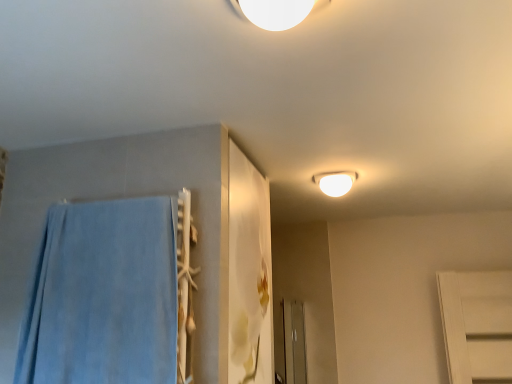
The image size is (512, 384). What are the coordinates of `blue soft towel at left` in the screenshot? It's located at (103, 296).

What is the approximate width of blue soft towel at left?

5.42 inches.

The image size is (512, 384). What do you see at coordinates (103, 296) in the screenshot?
I see `blue soft towel at left` at bounding box center [103, 296].

The width and height of the screenshot is (512, 384). Describe the element at coordinates (335, 182) in the screenshot. I see `white glossy light fixture at upper center` at that location.

Locate an element on the screen. The width and height of the screenshot is (512, 384). white glossy light fixture at upper center is located at coordinates (335, 182).

I want to click on blue soft towel at left, so click(103, 296).

Between blue soft towel at left and white glossy light fixture at upper center, which one appears on the left side from the viewer's perspective?

Positioned to the left is blue soft towel at left.

Looking at this image, relative to white glossy light fixture at upper center, is blue soft towel at left in front or behind?

Visually, blue soft towel at left is located in front of white glossy light fixture at upper center.

Considering the points (66, 291) and (322, 179), which point is behind, point (66, 291) or point (322, 179)?

The point (322, 179) is farther from the camera.

From the image's perspective, is blue soft towel at left located above white glossy light fixture at upper center?

No, from the image's perspective, blue soft towel at left is not on top of white glossy light fixture at upper center.

Looking at this image, from a real-world perspective, relative to white glossy light fixture at upper center, is blue soft towel at left vertically above or below?

blue soft towel at left is below white glossy light fixture at upper center.

Does blue soft towel at left have a greater width compared to white glossy light fixture at upper center?

Incorrect, the width of blue soft towel at left does not surpass that of white glossy light fixture at upper center.

Which of these two, blue soft towel at left or white glossy light fixture at upper center, stands taller?

blue soft towel at left is taller.

Can you confirm if blue soft towel at left is bigger than white glossy light fixture at upper center?

Correct, blue soft towel at left is larger in size than white glossy light fixture at upper center.

Choose the correct answer: Is blue soft towel at left inside white glossy light fixture at upper center or outside it?

blue soft towel at left exists outside the volume of white glossy light fixture at upper center.

Would you say blue soft towel at left is a long distance from white glossy light fixture at upper center?

That's right, there is a large distance between blue soft towel at left and white glossy light fixture at upper center.

Is blue soft towel at left turned away from white glossy light fixture at upper center?

No, blue soft towel at left's orientation is not away from white glossy light fixture at upper center.

What's the angular difference between blue soft towel at left and white glossy light fixture at upper center's facing directions?

blue soft towel at left and white glossy light fixture at upper center are facing 82.6 degrees away from each other.

Where is `bath towel located on the left of white glossy light fixture at upper center`? bath towel located on the left of white glossy light fixture at upper center is located at coordinates (103, 296).

Is white glossy light fixture at upper center to the right of blue soft towel at left from the viewer's perspective?

Yes.

Is white glossy light fixture at upper center behind blue soft towel at left?

Yes, white glossy light fixture at upper center is further from the viewer.

Which point is more forward, (348, 190) or (69, 364)?

Point (69, 364)

From the image's perspective, is white glossy light fixture at upper center above blue soft towel at left?

Yes, from the image's perspective, white glossy light fixture at upper center is above blue soft towel at left.

From a real-world perspective, relative to blue soft towel at left, is white glossy light fixture at upper center vertically above or below?

From a real-world perspective, white glossy light fixture at upper center is physically above blue soft towel at left.

Between white glossy light fixture at upper center and blue soft towel at left, which one has smaller width?

With smaller width is blue soft towel at left.

Who is taller, white glossy light fixture at upper center or blue soft towel at left?

blue soft towel at left.

Does white glossy light fixture at upper center have a larger size compared to blue soft towel at left?

Incorrect, white glossy light fixture at upper center is not larger than blue soft towel at left.

Do you think white glossy light fixture at upper center is within blue soft towel at left, or outside of it?

white glossy light fixture at upper center is not inside blue soft towel at left, it's outside.

Does white glossy light fixture at upper center touch blue soft towel at left?

white glossy light fixture at upper center and blue soft towel at left are not in contact.

Is white glossy light fixture at upper center oriented towards blue soft towel at left?

No, white glossy light fixture at upper center is not aimed at blue soft towel at left.

Can you tell me how much white glossy light fixture at upper center and blue soft towel at left differ in facing direction?

They differ by 82.6 degrees in their facing directions.

Measure the distance from white glossy light fixture at upper center to blue soft towel at left.

A distance of 1.32 meters exists between white glossy light fixture at upper center and blue soft towel at left.

Identify the location of lamp lying on the right of blue soft towel at left. (335, 182).

This screenshot has width=512, height=384. In order to click on bath towel below the white glossy light fixture at upper center (from the image's perspective) in this screenshot , I will do `click(103, 296)`.

Image resolution: width=512 pixels, height=384 pixels. I want to click on bath towel beneath the white glossy light fixture at upper center (from a real-world perspective), so click(103, 296).